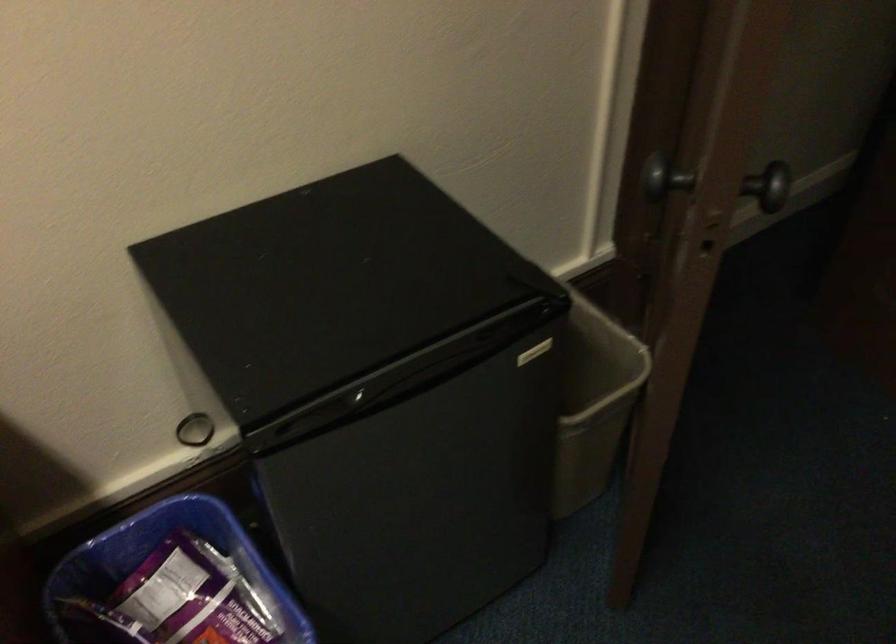
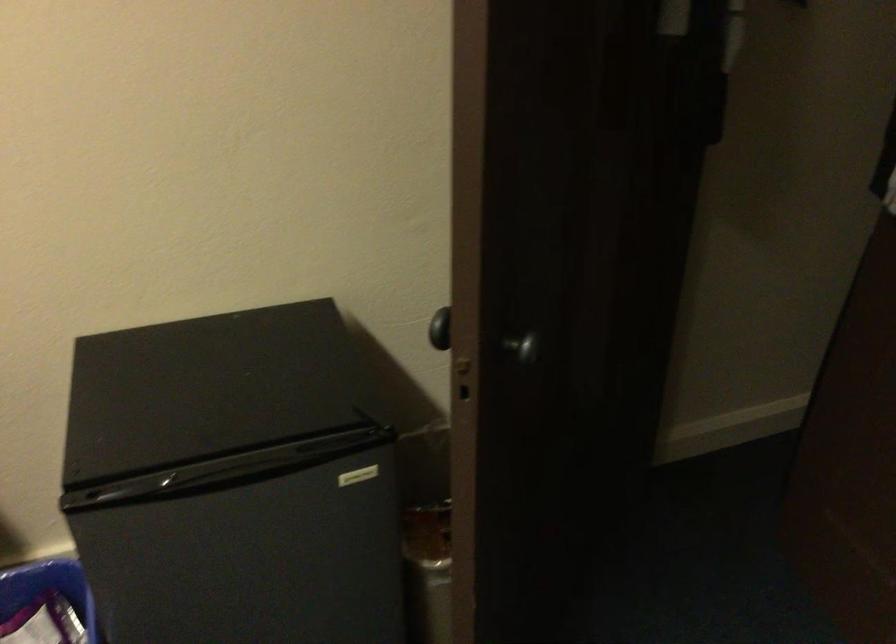
Question: Based on the continuous images, in which direction is the camera rotating? Reply with the corresponding letter.

Choices:
 (A) Left
 (B) Right
 (C) Up
 (D) Down

Answer: (C)